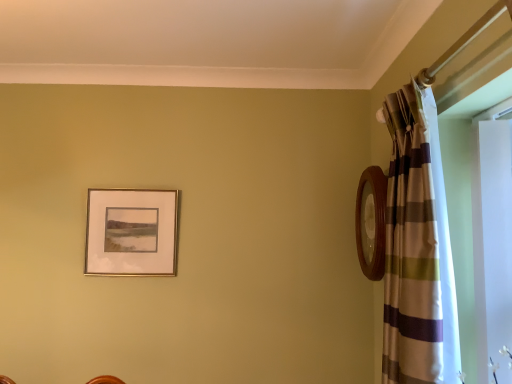
Locate an element on the screen. This screenshot has height=384, width=512. striped fabric curtain at right is located at coordinates (417, 249).

Image resolution: width=512 pixels, height=384 pixels. Describe the element at coordinates (417, 249) in the screenshot. I see `striped fabric curtain at right` at that location.

At what (x,y) coordinates should I click in order to perform the action: click on gold metallic picture frame at upper left. Please return your answer as a coordinate pair (x, y). The image size is (512, 384). Looking at the image, I should click on point(131,232).

What is the approximate width of gold metallic picture frame at upper left?

It is 4.73 centimeters.

The height and width of the screenshot is (384, 512). Describe the element at coordinates (131, 232) in the screenshot. I see `gold metallic picture frame at upper left` at that location.

Where is `striped fabric curtain at right`? The height and width of the screenshot is (384, 512). striped fabric curtain at right is located at coordinates (417, 249).

Considering the positions of objects gold metallic picture frame at upper left and striped fabric curtain at right in the image provided, who is more to the right, gold metallic picture frame at upper left or striped fabric curtain at right?

Positioned to the right is striped fabric curtain at right.

Is the depth of gold metallic picture frame at upper left greater than that of striped fabric curtain at right?

Yes, gold metallic picture frame at upper left is behind striped fabric curtain at right.

Is point (101, 230) closer to camera compared to point (393, 308)?

No, it is not.

Based on the photo, from the image's perspective, between gold metallic picture frame at upper left and striped fabric curtain at right, who is located below?

gold metallic picture frame at upper left, from the image's perspective.

From a real-world perspective, which is physically above, gold metallic picture frame at upper left or striped fabric curtain at right?

gold metallic picture frame at upper left.

Is gold metallic picture frame at upper left thinner than striped fabric curtain at right?

Yes, gold metallic picture frame at upper left is thinner than striped fabric curtain at right.

Is gold metallic picture frame at upper left shorter than striped fabric curtain at right?

Yes, gold metallic picture frame at upper left is shorter than striped fabric curtain at right.

Does gold metallic picture frame at upper left have a larger size compared to striped fabric curtain at right?

Actually, gold metallic picture frame at upper left might be smaller than striped fabric curtain at right.

Is gold metallic picture frame at upper left positioned beyond the bounds of striped fabric curtain at right?

That's correct, gold metallic picture frame at upper left is outside of striped fabric curtain at right.

Would you say gold metallic picture frame at upper left is a long distance from striped fabric curtain at right?

Indeed, gold metallic picture frame at upper left is not near striped fabric curtain at right.

Does gold metallic picture frame at upper left turn towards striped fabric curtain at right?

No.

Measure the distance from gold metallic picture frame at upper left to striped fabric curtain at right.

gold metallic picture frame at upper left and striped fabric curtain at right are 4.31 feet apart from each other.

Where is `curtain that appears in front of the gold metallic picture frame at upper left`? curtain that appears in front of the gold metallic picture frame at upper left is located at coordinates pos(417,249).

In the scene shown: Between striped fabric curtain at right and gold metallic picture frame at upper left, which one appears on the right side from the viewer's perspective?

striped fabric curtain at right.

Considering the positions of objects striped fabric curtain at right and gold metallic picture frame at upper left in the image provided, who is behind, striped fabric curtain at right or gold metallic picture frame at upper left?

gold metallic picture frame at upper left is further away from the camera.

Is point (386, 101) closer or farther from the camera than point (166, 238)?

Point (386, 101) appears to be closer to the viewer than point (166, 238).

From the image's perspective, is striped fabric curtain at right located beneath gold metallic picture frame at upper left?

No, from the image's perspective, striped fabric curtain at right is not below gold metallic picture frame at upper left.

From a real-world perspective, which is physically above, striped fabric curtain at right or gold metallic picture frame at upper left?

In real-world perspective, gold metallic picture frame at upper left is above.

Can you confirm if striped fabric curtain at right is thinner than gold metallic picture frame at upper left?

Incorrect, the width of striped fabric curtain at right is not less than that of gold metallic picture frame at upper left.

Can you confirm if striped fabric curtain at right is taller than gold metallic picture frame at upper left?

Yes, striped fabric curtain at right is taller than gold metallic picture frame at upper left.

In the scene shown: Is striped fabric curtain at right smaller than gold metallic picture frame at upper left?

No, striped fabric curtain at right is not smaller than gold metallic picture frame at upper left.

Is gold metallic picture frame at upper left located within striped fabric curtain at right?

No, striped fabric curtain at right does not contain gold metallic picture frame at upper left.

Is striped fabric curtain at right in contact with gold metallic picture frame at upper left?

No, striped fabric curtain at right is not touching gold metallic picture frame at upper left.

Is striped fabric curtain at right oriented towards gold metallic picture frame at upper left?

No, striped fabric curtain at right does not turn towards gold metallic picture frame at upper left.

How many degrees apart are the facing directions of striped fabric curtain at right and gold metallic picture frame at upper left?

They differ by 90.2 degrees in their facing directions.

Measure the distance from striped fabric curtain at right to gold metallic picture frame at upper left.

A distance of 1.31 meters exists between striped fabric curtain at right and gold metallic picture frame at upper left.

Identify the location of picture frame to the left of striped fabric curtain at right. (131, 232).

Locate an element on the screen. curtain above the gold metallic picture frame at upper left (from the image's perspective) is located at coordinates (417, 249).

Locate an element on the screen. The height and width of the screenshot is (384, 512). picture frame above the striped fabric curtain at right (from a real-world perspective) is located at coordinates (131, 232).